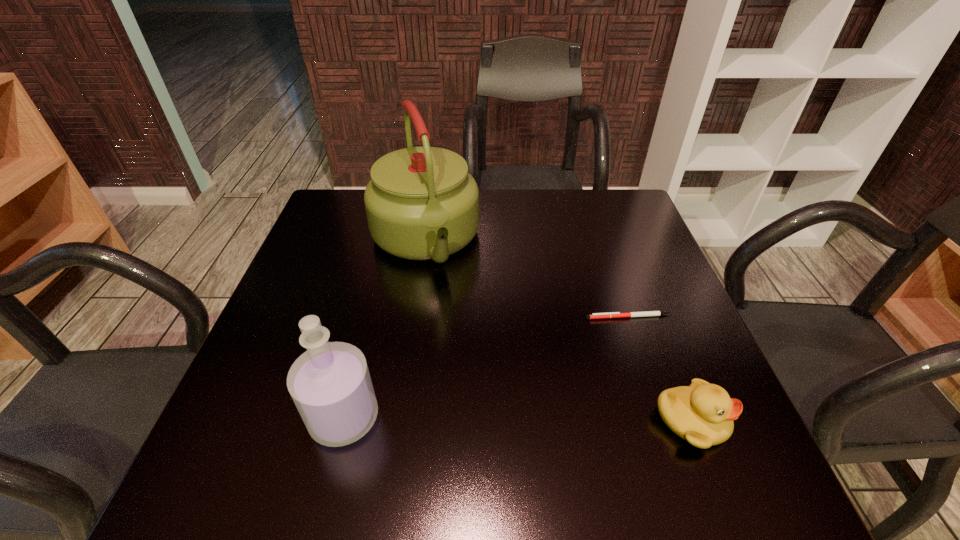
Locate an element on the screen. The height and width of the screenshot is (540, 960). vacant area located 0.150m on the clicker of the second farthest object is located at coordinates (541, 350).

In order to click on blank space located on the clicker of the second farthest object in this screenshot , I will do `click(566, 335)`.

Locate an element on the screen. vacant space positioned 0.310m on the clicker of the second farthest object is located at coordinates (476, 389).

Where is `object situated at the far edge`? The width and height of the screenshot is (960, 540). object situated at the far edge is located at coordinates (421, 203).

This screenshot has height=540, width=960. What are the coordinates of `perfume that is positioned at the near edge` in the screenshot? It's located at (330, 384).

Identify the location of duckling positioned at the near edge. pyautogui.click(x=702, y=414).

The image size is (960, 540). I want to click on perfume located at the left edge, so click(330, 384).

At what (x,y) coordinates should I click in order to perform the action: click on kettle located at the left edge. Please return your answer as a coordinate pair (x, y). Image resolution: width=960 pixels, height=540 pixels. Looking at the image, I should click on (421, 203).

The image size is (960, 540). I want to click on duckling located at the right edge, so (702, 414).

Locate an element on the screen. The height and width of the screenshot is (540, 960). pen located in the right edge section of the desktop is located at coordinates (647, 313).